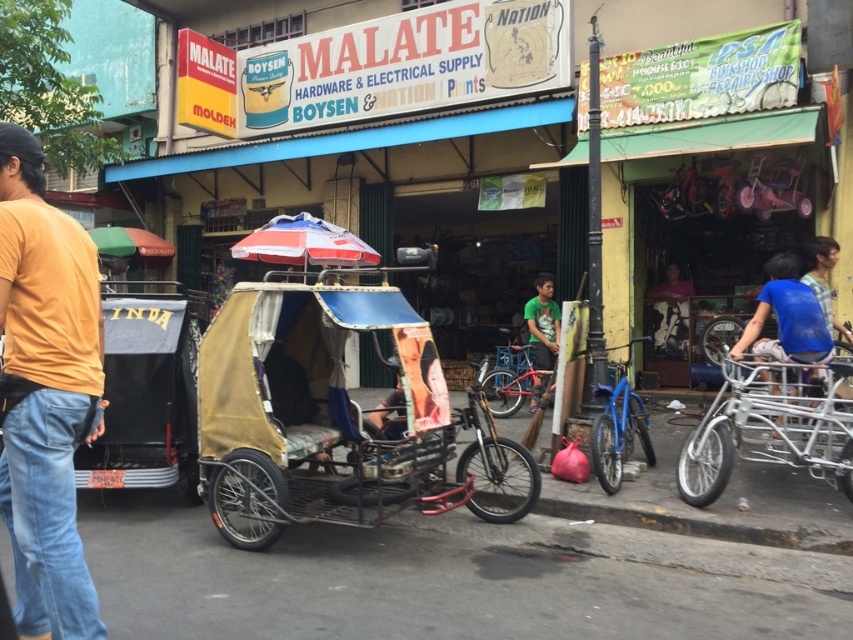
Is green matte shirt at center wider than green fabric umbrella at center?

In fact, green matte shirt at center might be narrower than green fabric umbrella at center.

Does green matte shirt at center have a lesser width compared to green fabric umbrella at center?

Yes, green matte shirt at center is thinner than green fabric umbrella at center.

Does point (543, 349) come in front of point (102, 243)?

Yes, it is.

The image size is (853, 640). What are the coordinates of `green matte shirt at center` in the screenshot? It's located at (543, 323).

Between blue matte bicycle at center-right and green fabric umbrella at center, which one has more height?

blue matte bicycle at center-right is taller.

At what (x,y) coordinates should I click in order to perform the action: click on blue matte bicycle at center-right. Please return your answer as a coordinate pair (x, y). Looking at the image, I should click on (618, 433).

Measure the distance between blue matte bicycle at center-right and camera.

blue matte bicycle at center-right and camera are 6.39 meters apart.

This screenshot has width=853, height=640. What are the coordinates of `blue matte bicycle at center-right` in the screenshot? It's located at (618, 433).

Is red and white striped umbrella at center bigger than blue fabric bicycle at right?

Correct, red and white striped umbrella at center is larger in size than blue fabric bicycle at right.

Is point (231, 248) farther from viewer compared to point (824, 284)?

Yes, it is behind point (824, 284).

The width and height of the screenshot is (853, 640). In order to click on red and white striped umbrella at center in this screenshot , I will do `click(305, 243)`.